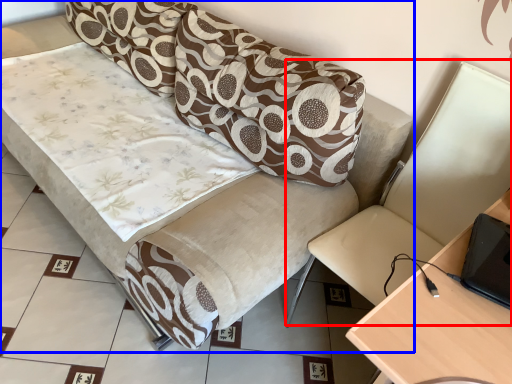
Question: Among these objects, which one is nearest to the camera, swivel chair (highlighted by a red box) or studio couch (highlighted by a blue box)?

Choices:
 (A) swivel chair
 (B) studio couch

Answer: (A)